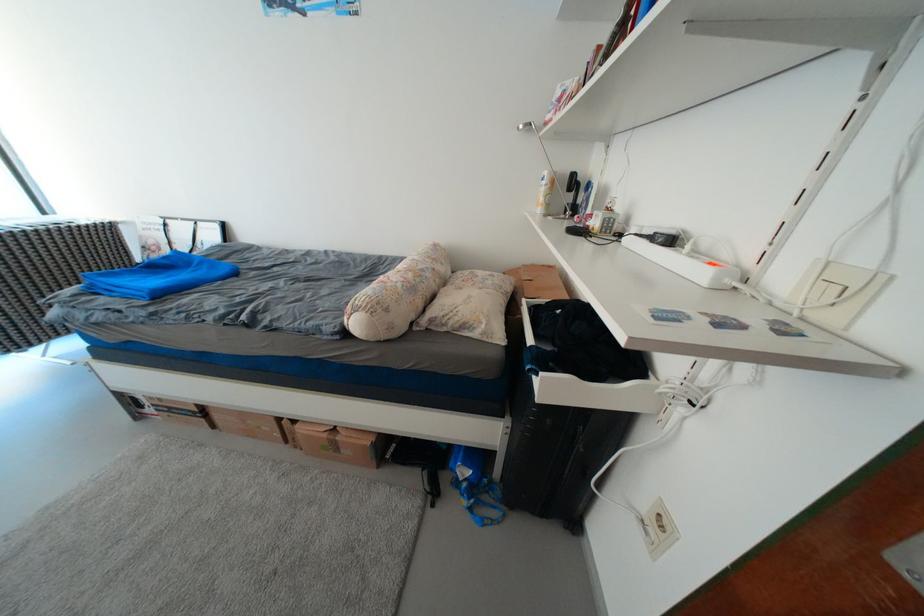
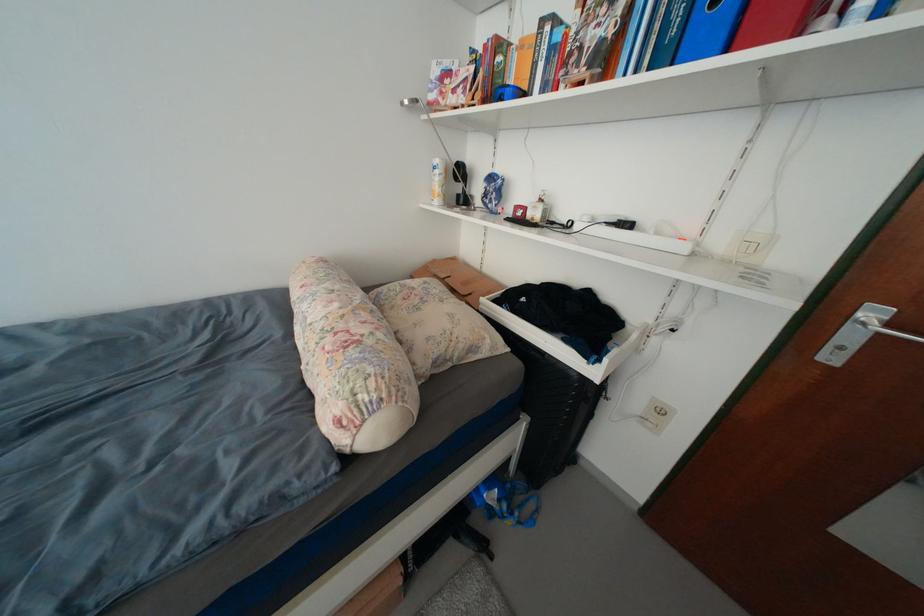
Question: How did the camera likely rotate?

Choices:
 (A) Left
 (B) Right
 (C) Up
 (D) Down

Answer: (B)